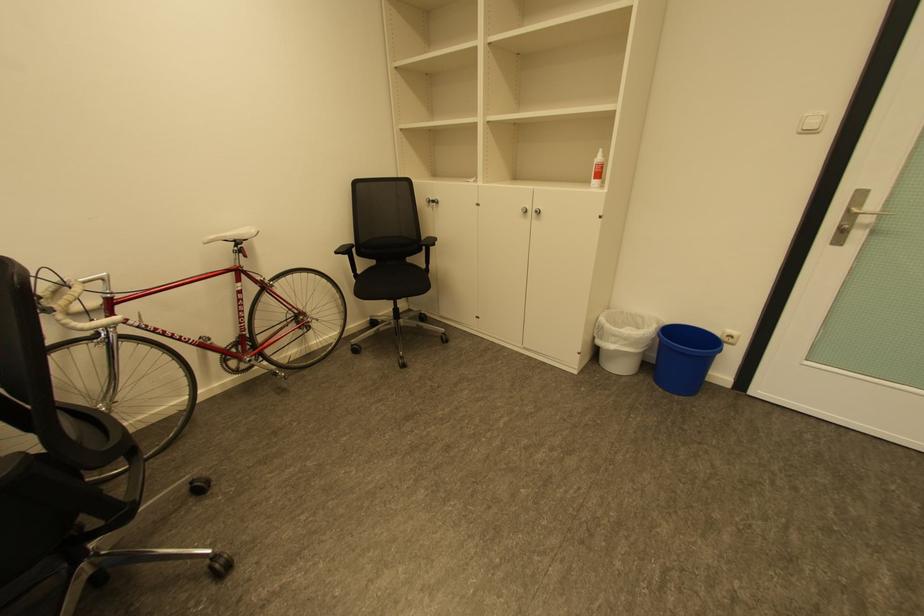
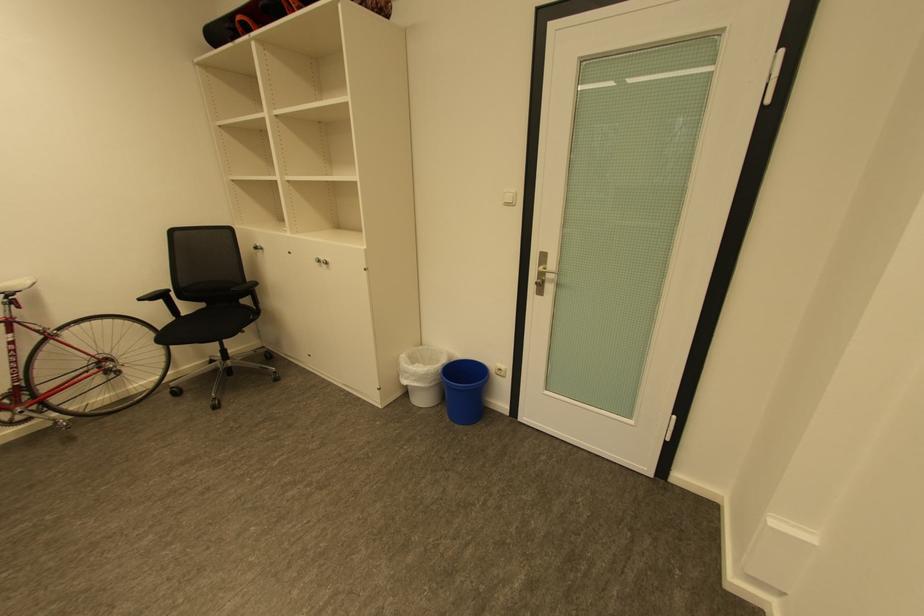
Where in the second image is the point corresponding to (366,272) from the first image?

(190, 315)